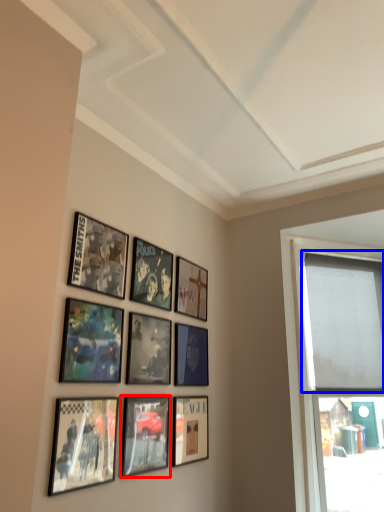
Question: Which of the following is the closest to the observer, picture frame (highlighted by a red box) or window screen (highlighted by a blue box)?

Choices:
 (A) picture frame
 (B) window screen

Answer: (A)